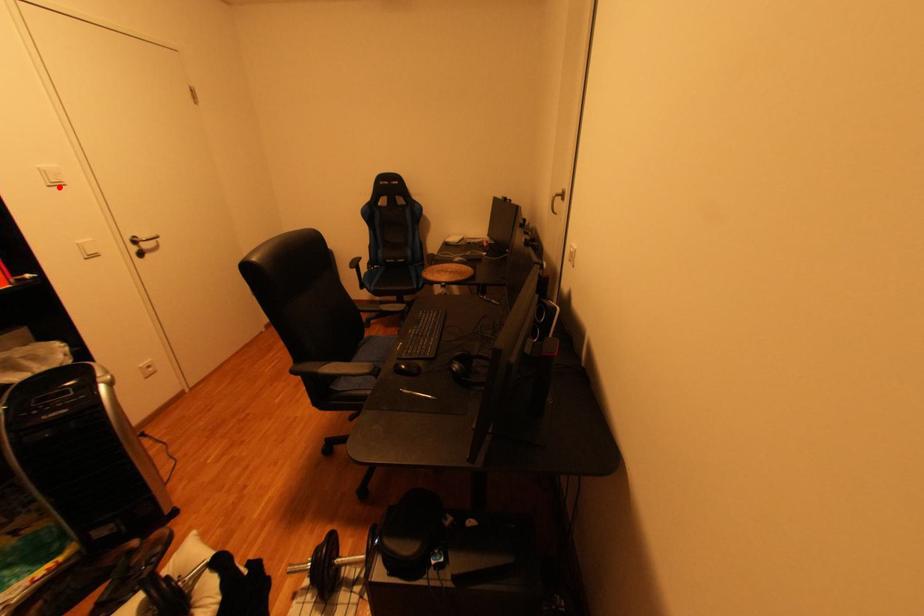
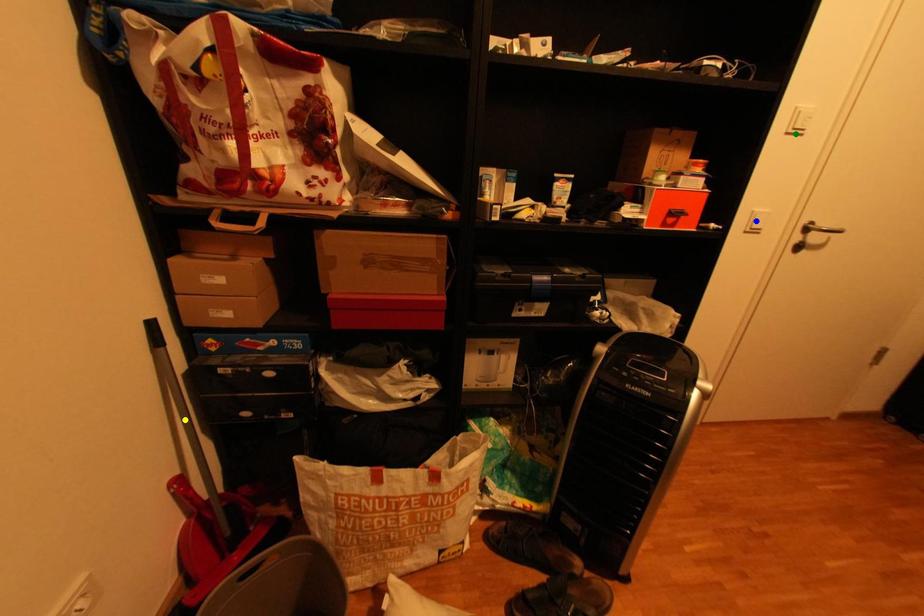
Question: I am providing you with two images of the same scene from different viewpoints. A red point is marked on the first image. You are given multiple points on the second image. Which point in image 2 represents the same 3d spot as the red point in image 1?

Choices:
 (A) blue point
 (B) green point
 (C) yellow point

Answer: (B)